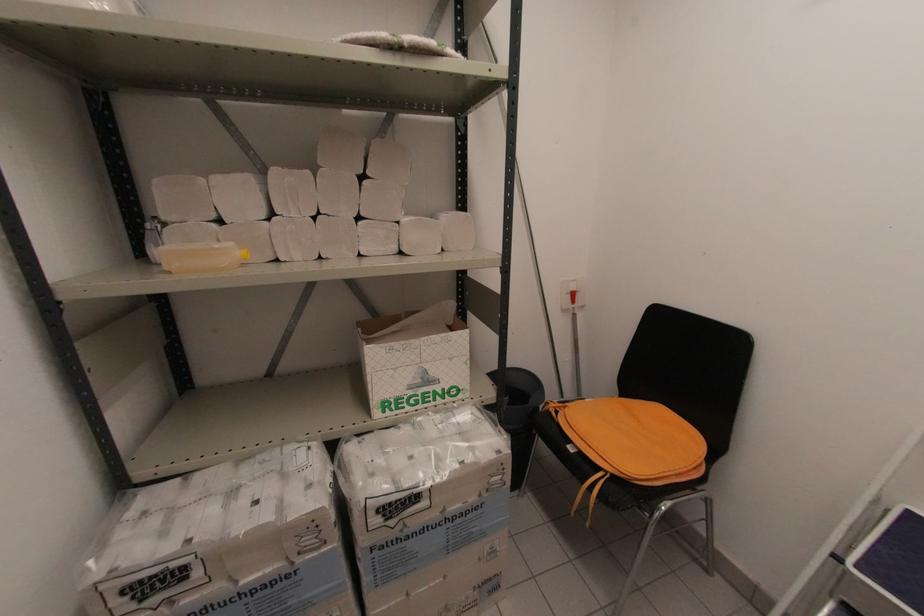
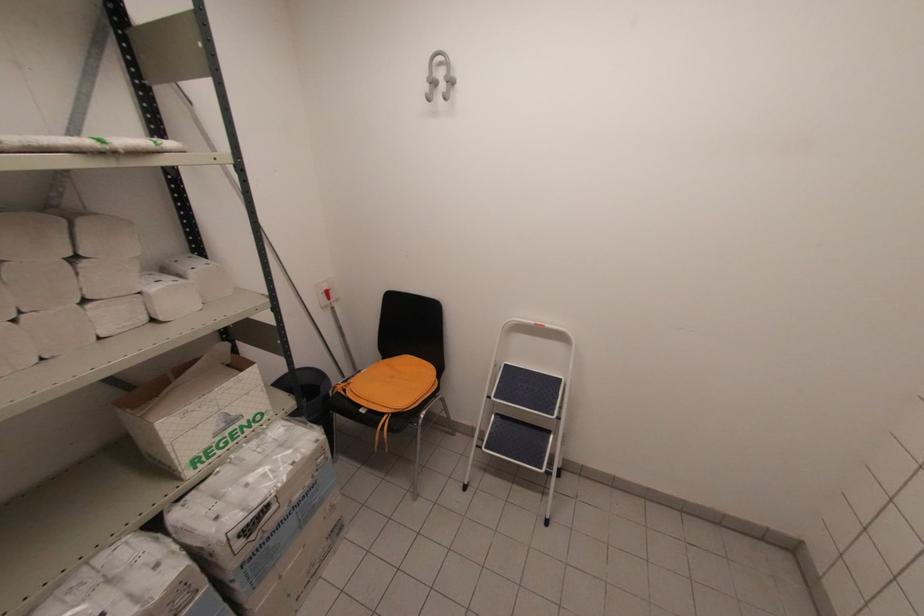
Locate, in the second image, the point that corresponds to pixel 588 400 in the first image.

(362, 371)